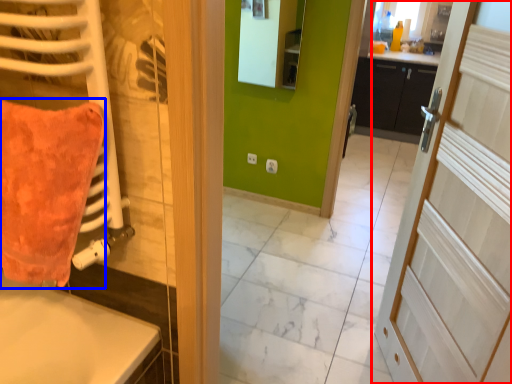
Question: Which object appears farthest to the camera in this image, door (highlighted by a red box) or throw pillow (highlighted by a blue box)?

Choices:
 (A) door
 (B) throw pillow

Answer: (B)